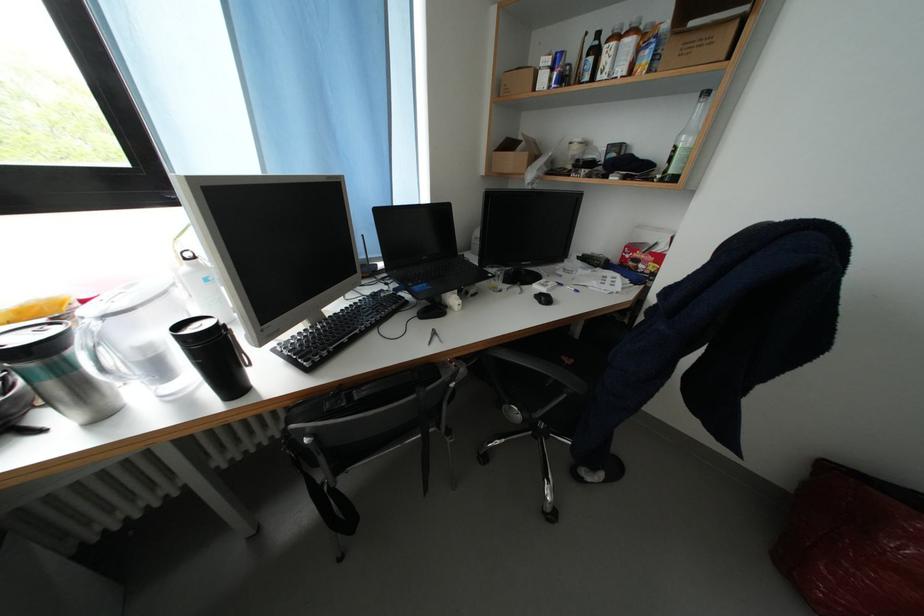
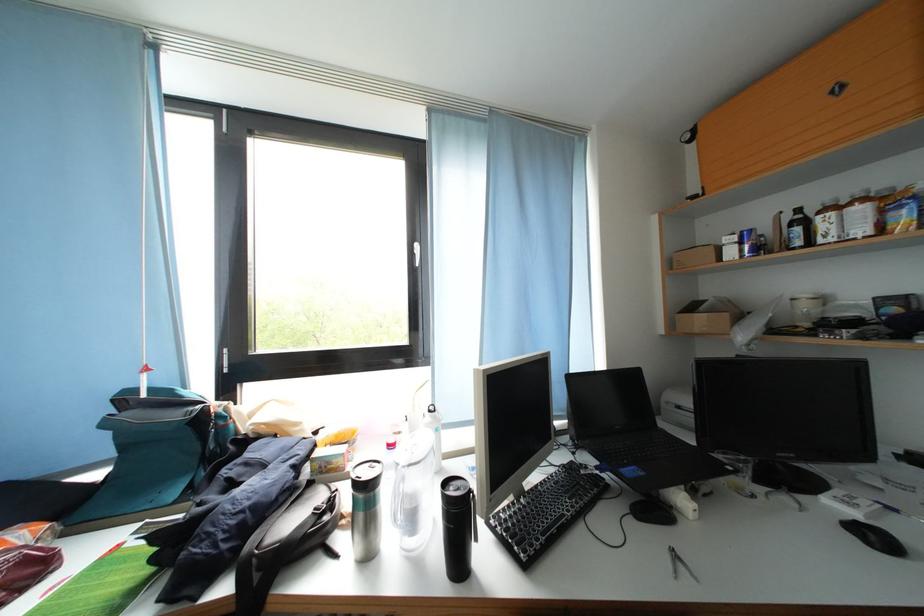
Find the pixel in the second image that matches point (93, 307) in the first image.

(398, 451)